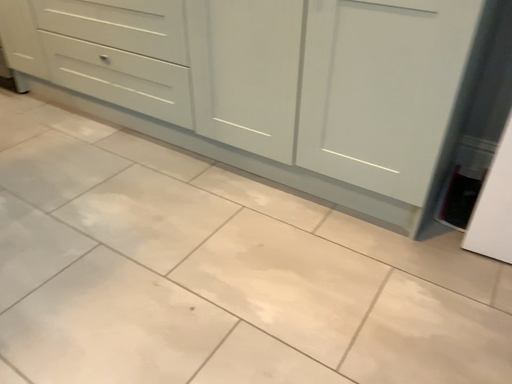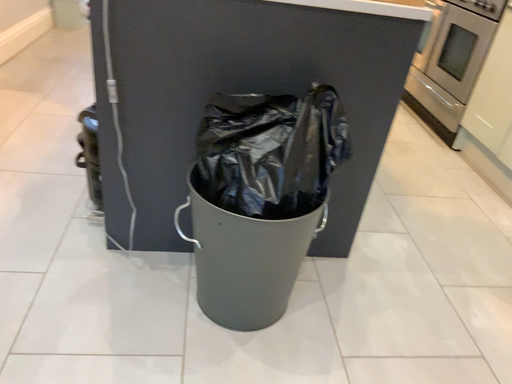
Question: Which way did the camera rotate in the video?

Choices:
 (A) rotated left
 (B) rotated right

Answer: (A)